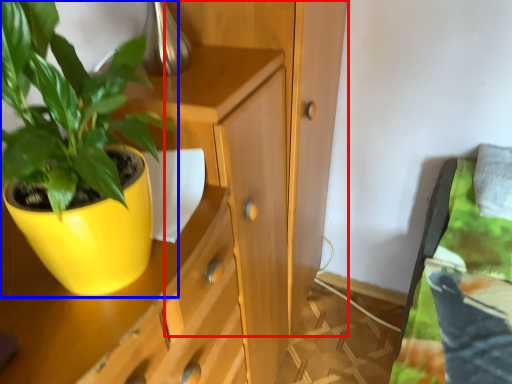
Question: Which of the following is the farthest to the observer, dresser (highlighted by a red box) or houseplant (highlighted by a blue box)?

Choices:
 (A) dresser
 (B) houseplant

Answer: (A)